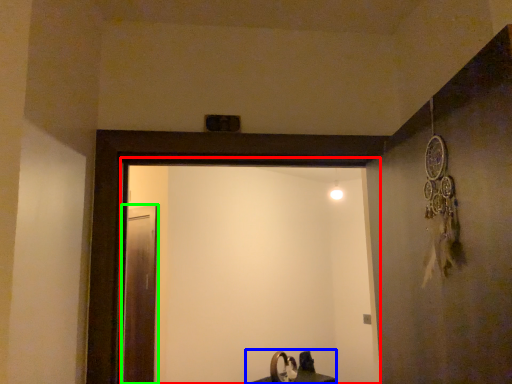
Question: Which object is the farthest from screen door (highlighted by a red box)? Choose among these: sink (highlighted by a blue box) or screen door (highlighted by a green box).

Choices:
 (A) sink
 (B) screen door

Answer: (B)